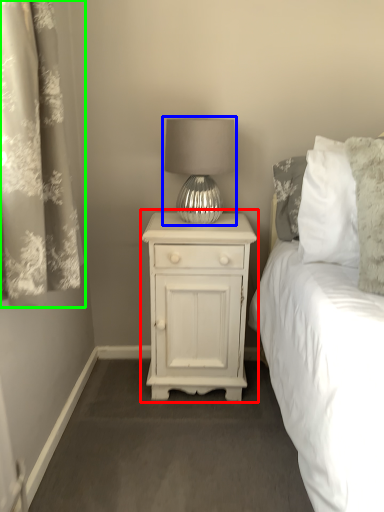
Question: Which is nearer to the nightstand (highlighted by a red box)? lamp (highlighted by a blue box) or curtain (highlighted by a green box).

Choices:
 (A) lamp
 (B) curtain

Answer: (A)